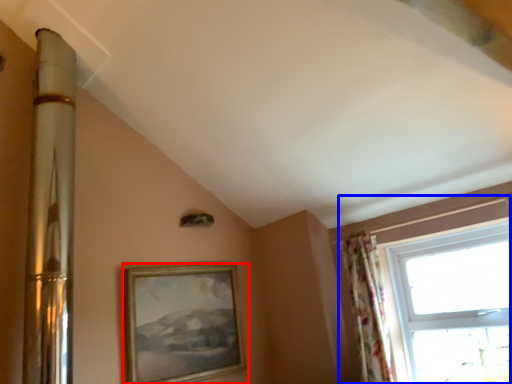
Question: Which object is further to the camera taking this photo, picture frame (highlighted by a red box) or window (highlighted by a blue box)?

Choices:
 (A) picture frame
 (B) window

Answer: (A)